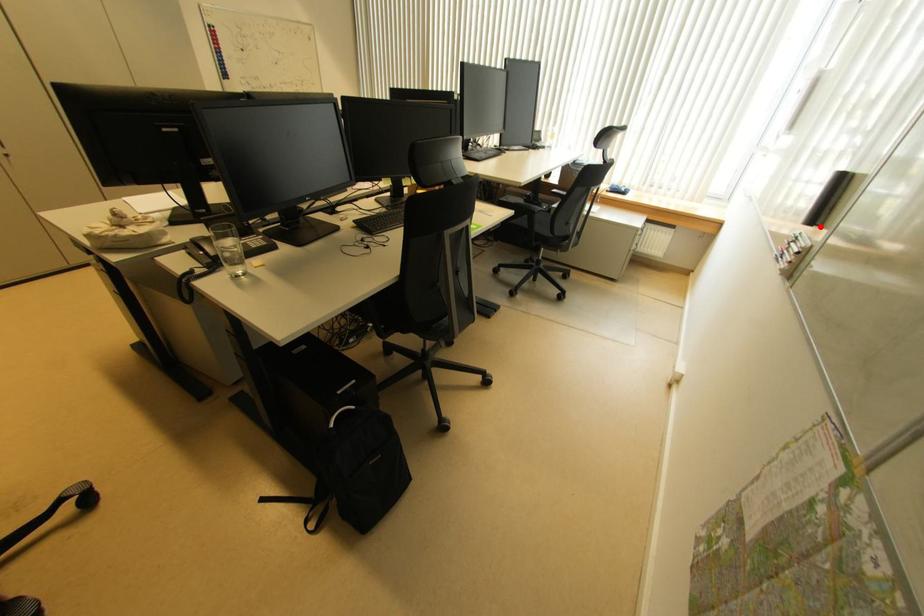
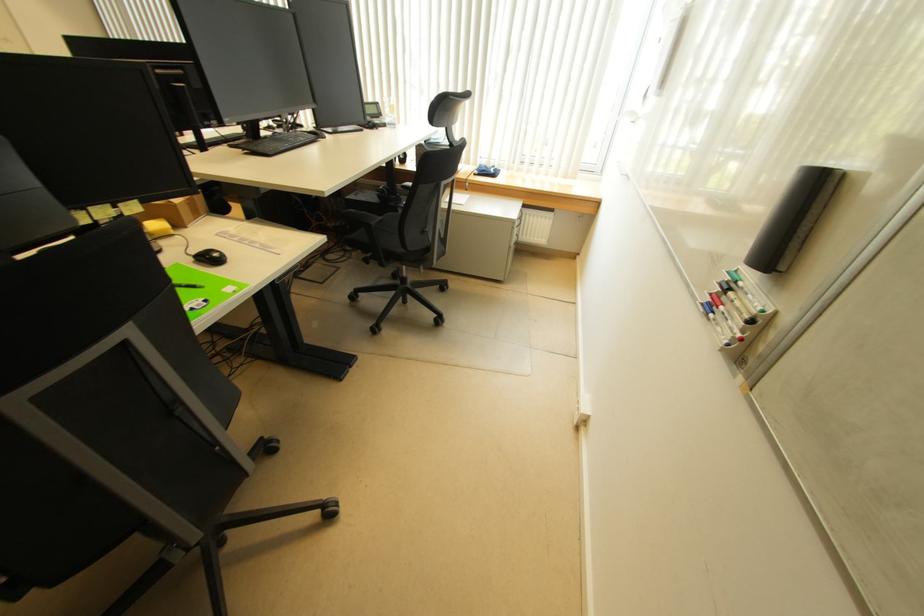
In the second image, find the point that corresponds to the highlighted location in the first image.

(784, 272)